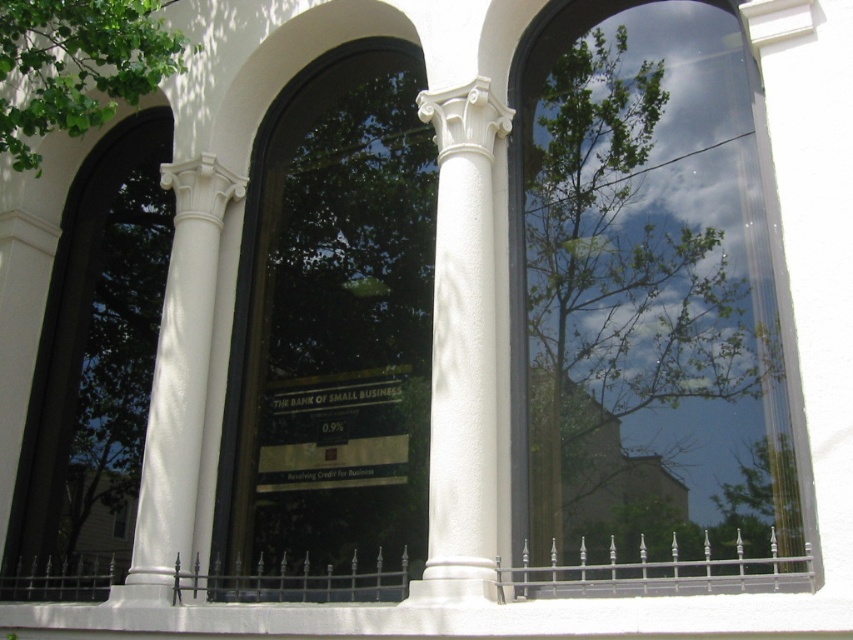
You are standing in front of the building and notice the green leafy tree at upper right and the white smooth column at center. Which object is positioned nearer to your current viewpoint?

The green leafy tree at upper right is closer to the viewer than the white smooth column at center.